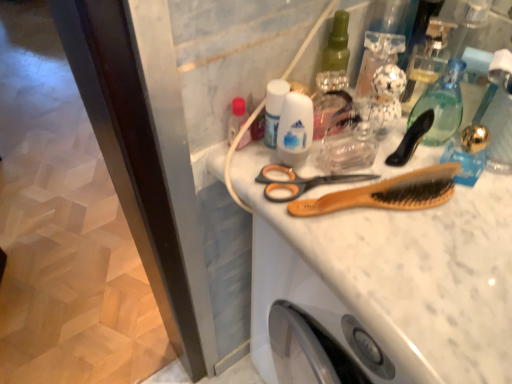
Question: Should I look upward or downward to see matte plastic bottle at upper left, marked as the second toiletry in a right-to-left arrangement?

Choices:
 (A) up
 (B) down

Answer: (A)

Question: Can you confirm if white glossy mouthwash at center, which appears as the 1th mouthwash when viewed from the left, is thinner than matte plastic bottle at upper left, marked as the second toiletry in a right-to-left arrangement?

Choices:
 (A) yes
 (B) no

Answer: (B)

Question: Is white glossy mouthwash at center, which appears as the 1th mouthwash when viewed from the left, positioned far away from matte plastic bottle at upper left, the first toiletry viewed from the left?

Choices:
 (A) no
 (B) yes

Answer: (A)

Question: Would you say white glossy mouthwash at center, which appears as the 2th mouthwash when viewed from the right, is outside matte plastic bottle at upper left, marked as the second toiletry in a right-to-left arrangement?

Choices:
 (A) yes
 (B) no

Answer: (A)

Question: Considering the relative sizes of white glossy mouthwash at center, which appears as the 1th mouthwash when viewed from the left, and matte plastic bottle at upper left, the first toiletry viewed from the left, in the image provided, is white glossy mouthwash at center, which appears as the 1th mouthwash when viewed from the left, bigger than matte plastic bottle at upper left, the first toiletry viewed from the left,?

Choices:
 (A) yes
 (B) no

Answer: (A)

Question: Is white glossy mouthwash at center, which appears as the 2th mouthwash when viewed from the right, shorter than matte plastic bottle at upper left, the first toiletry viewed from the left?

Choices:
 (A) yes
 (B) no

Answer: (B)

Question: Is white glossy mouthwash at center, which appears as the 1th mouthwash when viewed from the left, oriented away from matte plastic bottle at upper left, the first toiletry viewed from the left?

Choices:
 (A) no
 (B) yes

Answer: (A)

Question: From the image's perspective, does white glossy mouthwash at center, which appears as the 1th mouthwash when viewed from the left, appear lower than wooden comb at center?

Choices:
 (A) no
 (B) yes

Answer: (A)

Question: Is wooden comb at center a part of white glossy mouthwash at center, which appears as the 1th mouthwash when viewed from the left?

Choices:
 (A) no
 (B) yes

Answer: (A)

Question: Could you tell me if white glossy mouthwash at center, which appears as the 2th mouthwash when viewed from the right, is turned towards wooden comb at center?

Choices:
 (A) yes
 (B) no

Answer: (B)

Question: From a real-world perspective, is white glossy mouthwash at center, which appears as the 2th mouthwash when viewed from the right, located beneath wooden comb at center?

Choices:
 (A) no
 (B) yes

Answer: (A)

Question: Is white glossy mouthwash at center, which appears as the 2th mouthwash when viewed from the right, completely or partially outside of wooden comb at center?

Choices:
 (A) yes
 (B) no

Answer: (A)

Question: Is white glossy mouthwash at center, which appears as the 1th mouthwash when viewed from the left, positioned in front of wooden comb at center?

Choices:
 (A) no
 (B) yes

Answer: (A)

Question: Can you confirm if translucent glass mouthwash at upper right, the first mouthwash in the right-to-left sequence, is shorter than matte plastic bottle at upper left, the first toiletry viewed from the left?

Choices:
 (A) yes
 (B) no

Answer: (B)